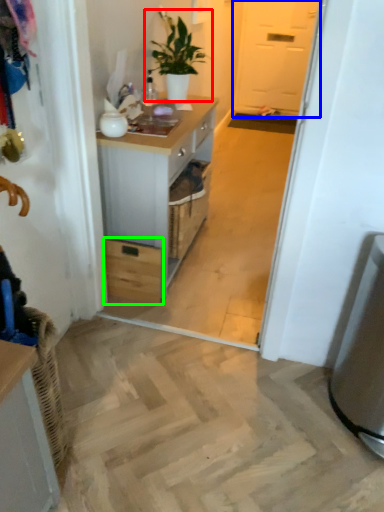
Question: Which object is the closest to the houseplant (highlighted by a red box)? Choose among these: screen door (highlighted by a blue box) or drawer (highlighted by a green box).

Choices:
 (A) screen door
 (B) drawer

Answer: (B)